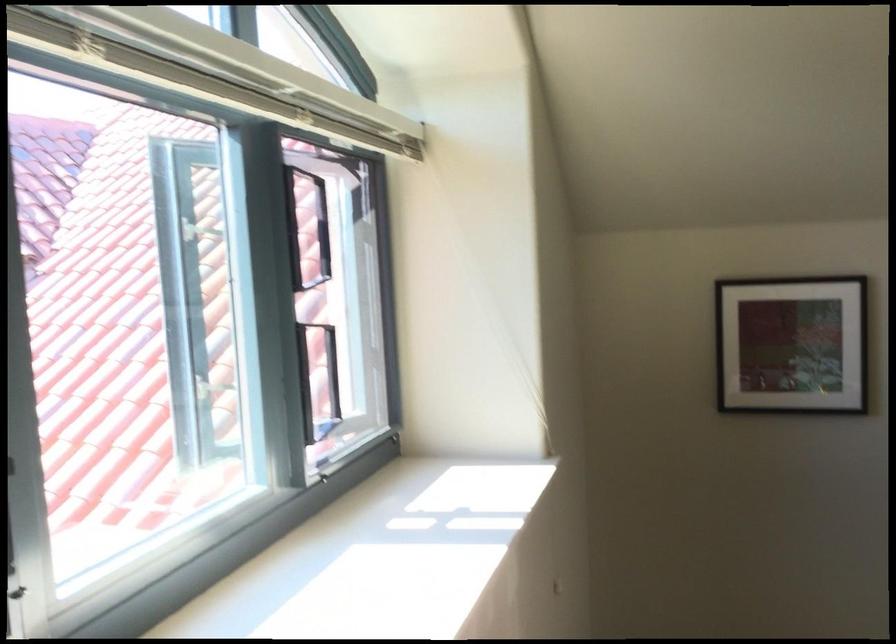
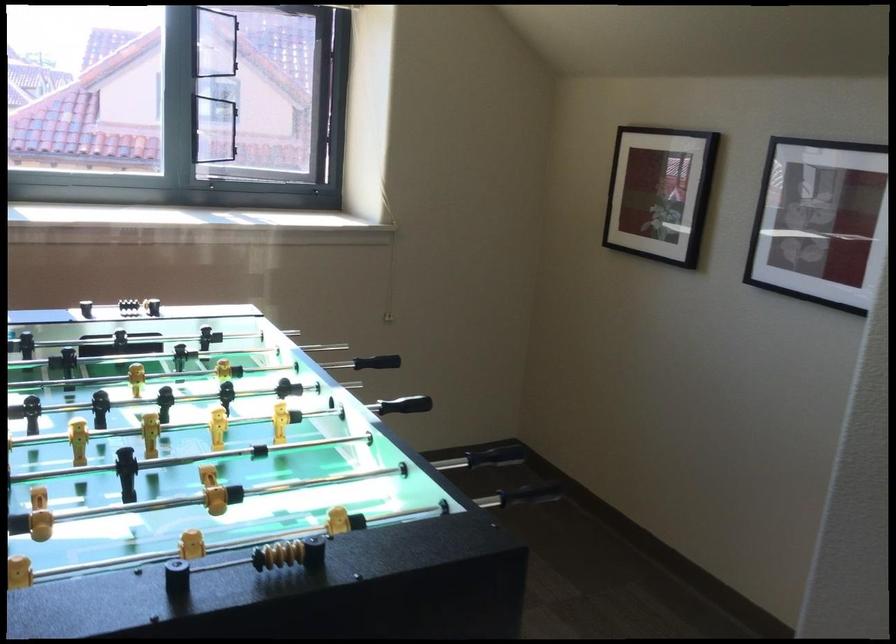
Locate, in the second image, the point that corresponds to (815,346) in the first image.

(659, 193)